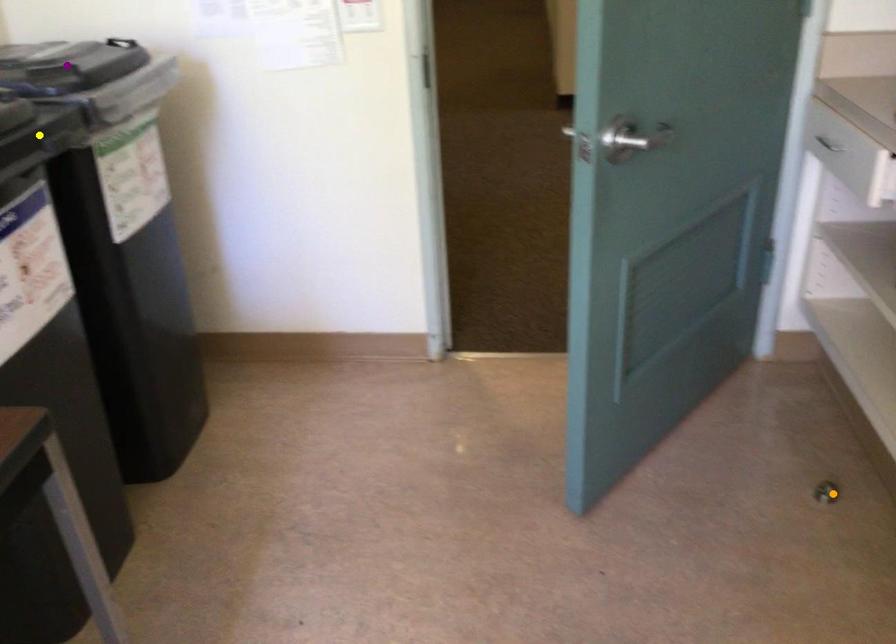
Order these from nearest to farthest:
orange point, purple point, yellow point

yellow point → purple point → orange point